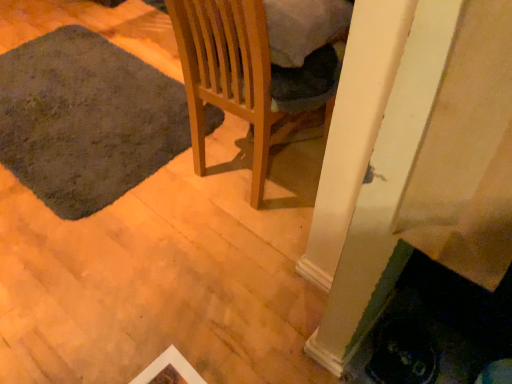
Image resolution: width=512 pixels, height=384 pixels. In order to click on free location in front of wooden chair at center in this screenshot , I will do `click(234, 243)`.